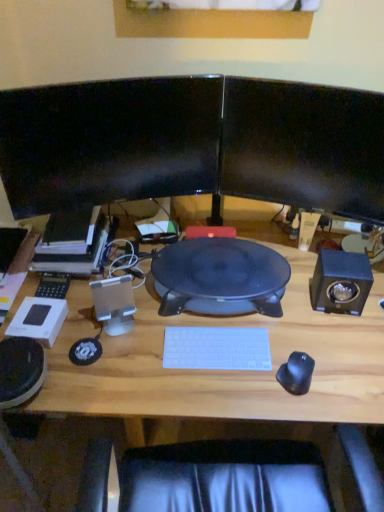
Identify the location of free space behind white plastic keyboard at center. (211, 318).